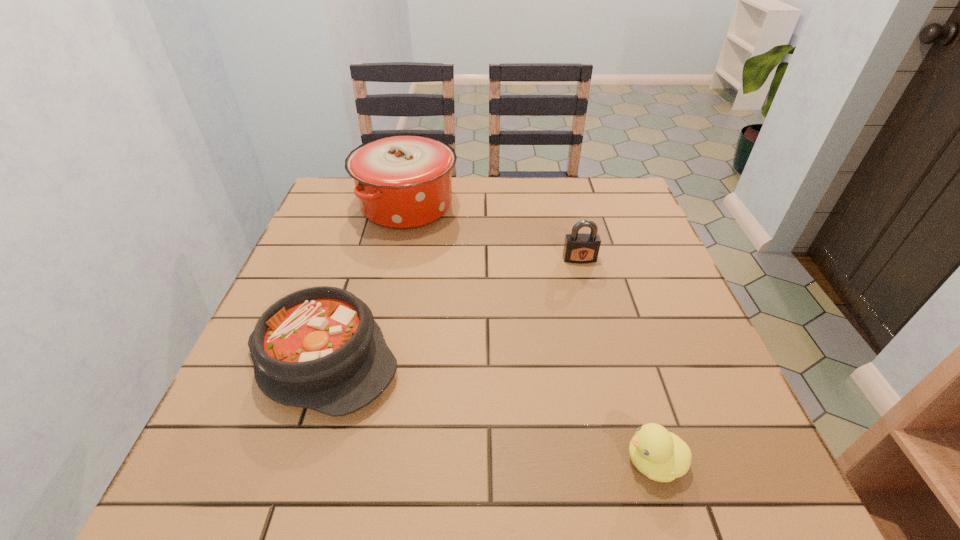
Find the location of a particular element. vacant point located at the beak of the shortest object is located at coordinates (587, 462).

This screenshot has height=540, width=960. In order to click on vacant area situated 0.130m at the beak of the shortest object in this screenshot , I will do `click(543, 462)`.

Locate an element on the screen. The height and width of the screenshot is (540, 960). vacant space situated at the beak of the shortest object is located at coordinates (519, 462).

What are the coordinates of `object that is positioned at the far edge` in the screenshot? It's located at (403, 181).

Where is `object at the near edge`? The image size is (960, 540). object at the near edge is located at coordinates click(x=662, y=456).

At what (x,y) coordinates should I click in order to perform the action: click on object that is positioned at the right edge. Please return your answer as a coordinate pair (x, y). The height and width of the screenshot is (540, 960). Looking at the image, I should click on (662, 456).

Where is `object located at the far left corner`? The image size is (960, 540). object located at the far left corner is located at coordinates (403, 181).

Where is `object located in the near right corner section of the desktop`? object located in the near right corner section of the desktop is located at coordinates click(662, 456).

The width and height of the screenshot is (960, 540). In the image, there is a desktop. Identify the location of blank space at the far edge. (510, 212).

The image size is (960, 540). What are the coordinates of `free region at the near edge` in the screenshot? It's located at (351, 460).